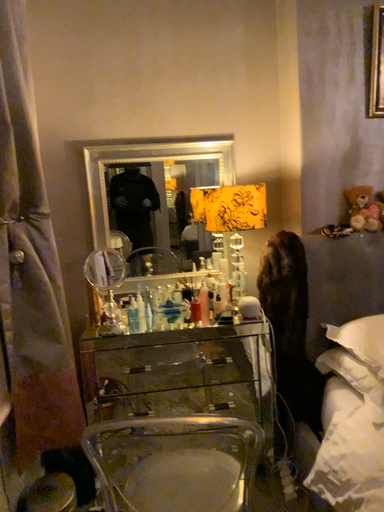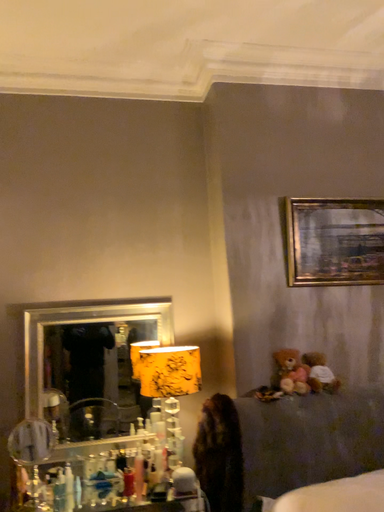
Question: How did the camera likely rotate when shooting the video?

Choices:
 (A) rotated upward
 (B) rotated downward

Answer: (A)